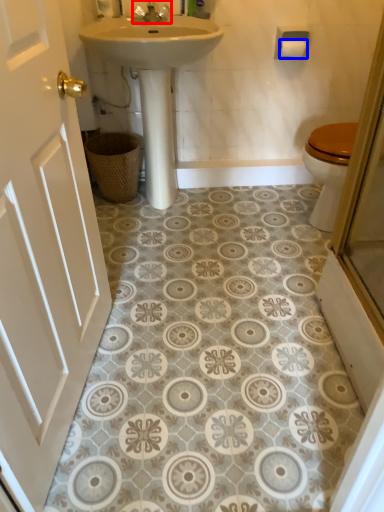
Question: Which object appears closest to the camera in this image, tap (highlighted by a red box) or toilet paper (highlighted by a blue box)?

Choices:
 (A) tap
 (B) toilet paper

Answer: (A)